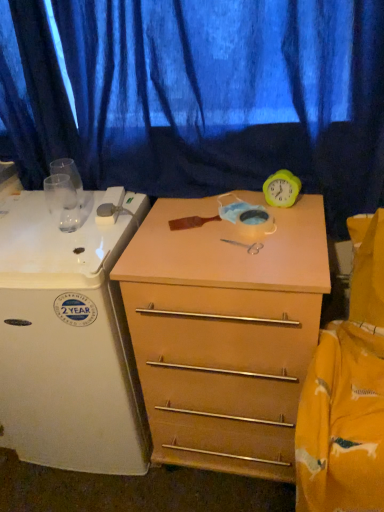
The width and height of the screenshot is (384, 512). What are the coordinates of `vacant space in front of yellow rubber clock at upper right` in the screenshot? It's located at (283, 238).